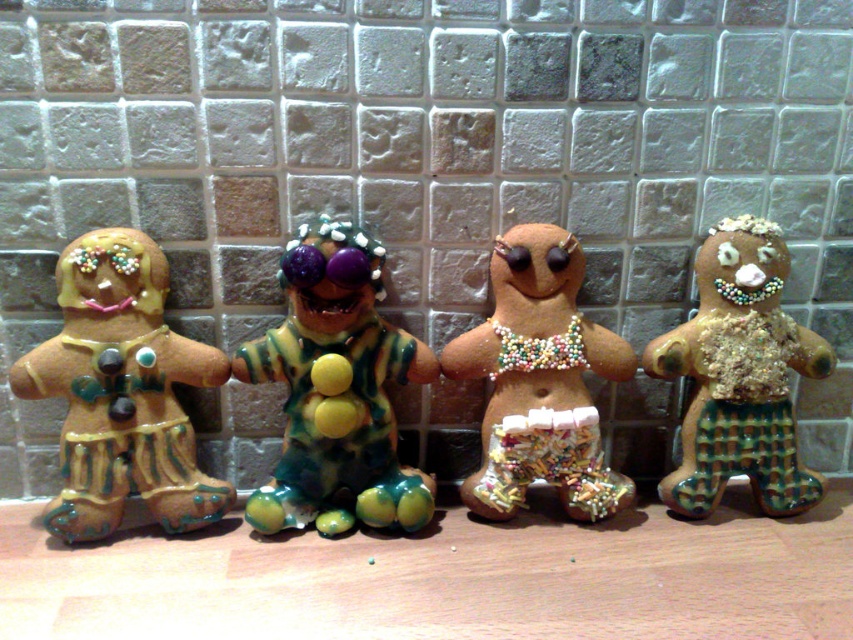
Question: Does matte brown gingerbread man at left have a smaller size compared to glittery brown gingerbread man at right?

Choices:
 (A) yes
 (B) no

Answer: (A)

Question: Which point is closer to the camera taking this photo?

Choices:
 (A) (608, 352)
 (B) (370, 404)

Answer: (B)

Question: Which of these objects is positioned farthest from the glossy ceramic gingerbread man at center?

Choices:
 (A) glittery gingerbread man at center
 (B) matte brown gingerbread man at left
 (C) glittery brown gingerbread man at right

Answer: (C)

Question: Is matte brown gingerbread man at left closer to camera compared to glittery brown gingerbread man at right?

Choices:
 (A) no
 (B) yes

Answer: (B)

Question: Is matte brown gingerbread man at left to the left of glittery brown gingerbread man at right from the viewer's perspective?

Choices:
 (A) no
 (B) yes

Answer: (B)

Question: Which object is the farthest from the glossy ceramic gingerbread man at center?

Choices:
 (A) glittery gingerbread man at center
 (B) matte brown gingerbread man at left
 (C) glittery brown gingerbread man at right

Answer: (C)